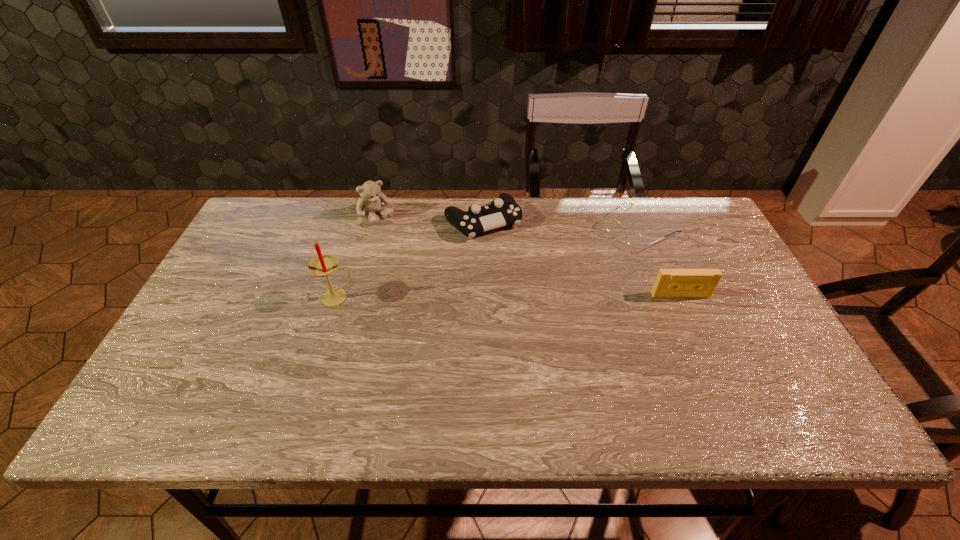
Where is `spectacles present at the right edge`? Image resolution: width=960 pixels, height=540 pixels. spectacles present at the right edge is located at coordinates (634, 239).

I want to click on object at the far right corner, so click(634, 239).

The width and height of the screenshot is (960, 540). Identify the location of free space at the far edge. (388, 222).

Find the location of `free space at the near edge of the desktop`. free space at the near edge of the desktop is located at coordinates (437, 390).

Locate an element on the screen. The width and height of the screenshot is (960, 540). free space at the left edge of the desktop is located at coordinates (195, 330).

Locate an element on the screen. This screenshot has height=540, width=960. vacant space at the right edge is located at coordinates (774, 332).

In the image, there is a desktop. Identify the location of free space at the far left corner. (248, 238).

Image resolution: width=960 pixels, height=540 pixels. I want to click on vacant region at the near left corner, so click(x=154, y=389).

Find the location of a particular element. The image size is (960, 540). vacant region between the videotape and the spectacles is located at coordinates (660, 262).

Where is `free area in between the third object from right to left and the second tallest object`? free area in between the third object from right to left and the second tallest object is located at coordinates (430, 219).